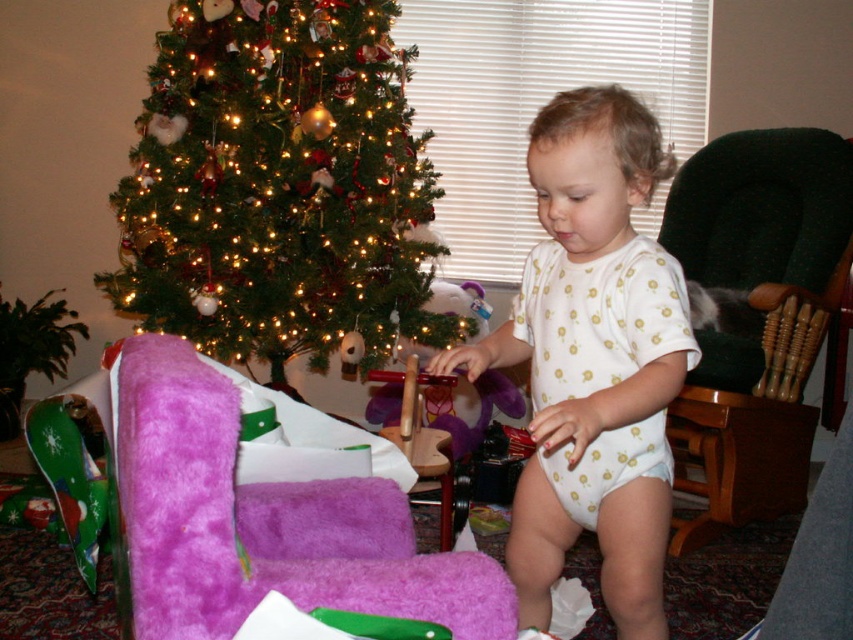
Question: Is white dotted onesie at center further to camera compared to green felt tree at left?

Choices:
 (A) yes
 (B) no

Answer: (B)

Question: Which object appears farthest from the camera in this image?

Choices:
 (A) white dotted diaper at center
 (B) green fabric armchair at right
 (C) green felt tree at left

Answer: (C)

Question: Can you confirm if white dotted onesie at center is thinner than green fabric armchair at right?

Choices:
 (A) no
 (B) yes

Answer: (B)

Question: Can you confirm if green matte christmas tree at upper left is positioned below white dotted diaper at center?

Choices:
 (A) no
 (B) yes

Answer: (A)

Question: Which of the following is the farthest from the observer?

Choices:
 (A) (567, 490)
 (B) (646, 452)
 (C) (352, 369)

Answer: (C)

Question: Which of the following is the farthest from the observer?

Choices:
 (A) white dotted onesie at center
 (B) green fabric armchair at right
 (C) green matte christmas tree at upper left
 (D) green felt tree at left

Answer: (D)